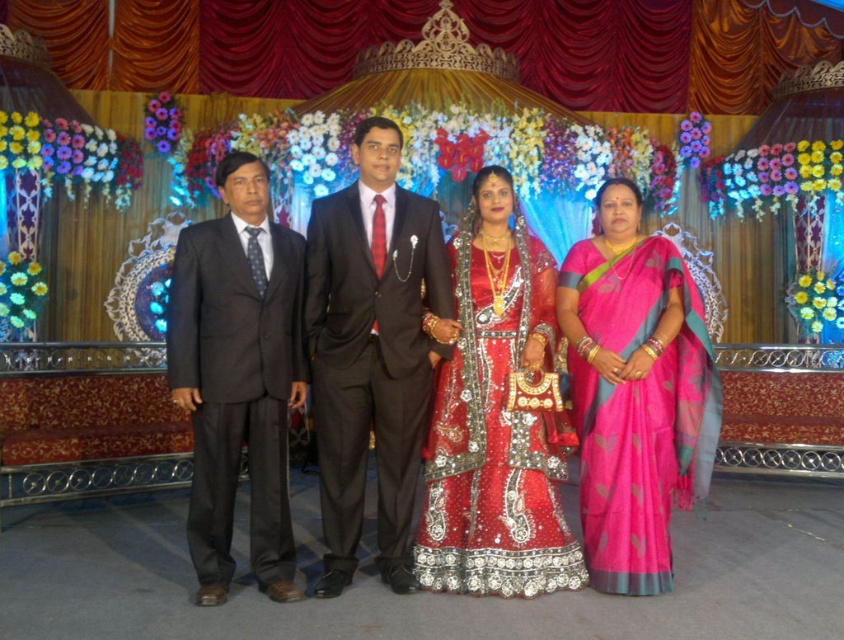
Question: In this image, where is dark gray suit at left located relative to red sequined lehenga at center?

Choices:
 (A) below
 (B) above

Answer: (B)

Question: Which point is farther from the camera taking this photo?

Choices:
 (A) (264, 410)
 (B) (533, 307)
 (C) (579, 259)
 (D) (468, 516)

Answer: (C)

Question: From the image, what is the correct spatial relationship of shiny red dress at center in relation to shiny black suit at center?

Choices:
 (A) above
 (B) below

Answer: (B)

Question: Is shiny red dress at center to the right of shiny black suit at center from the viewer's perspective?

Choices:
 (A) yes
 (B) no

Answer: (A)

Question: Which point appears closest to the camera in this image?

Choices:
 (A) (441, 460)
 (B) (507, 346)
 (C) (176, 272)
 (D) (317, 259)

Answer: (A)

Question: Which object is the farthest from the dark gray suit at left?

Choices:
 (A) shiny red dress at center
 (B) shiny black suit at center
 (C) red sequined lehenga at center

Answer: (C)